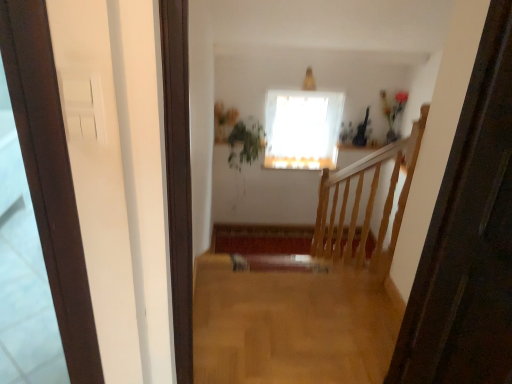
Question: Is the position of white sheer curtain at upper center more distant than that of green leafy plant at upper center?

Choices:
 (A) no
 (B) yes

Answer: (B)

Question: Is white sheer curtain at upper center thinner than green leafy plant at upper center?

Choices:
 (A) yes
 (B) no

Answer: (A)

Question: Would you say white sheer curtain at upper center contains green leafy plant at upper center?

Choices:
 (A) yes
 (B) no

Answer: (B)

Question: Can you confirm if white sheer curtain at upper center is shorter than green leafy plant at upper center?

Choices:
 (A) no
 (B) yes

Answer: (A)

Question: Is white sheer curtain at upper center not close to green leafy plant at upper center?

Choices:
 (A) no
 (B) yes

Answer: (A)

Question: From a real-world perspective, is white sheer curtain at upper center above or below light brown wood floor at center?

Choices:
 (A) above
 (B) below

Answer: (B)

Question: In terms of size, does white sheer curtain at upper center appear bigger or smaller than light brown wood floor at center?

Choices:
 (A) small
 (B) big

Answer: (B)

Question: Is white sheer curtain at upper center taller or shorter than light brown wood floor at center?

Choices:
 (A) short
 (B) tall

Answer: (B)

Question: From the image's perspective, relative to light brown wood floor at center, is white sheer curtain at upper center above or below?

Choices:
 (A) above
 (B) below

Answer: (A)

Question: In terms of width, does light brown wood floor at center look wider or thinner when compared to white sheer curtain at upper center?

Choices:
 (A) wide
 (B) thin

Answer: (A)

Question: Would you say light brown wood floor at center is inside or outside white sheer curtain at upper center?

Choices:
 (A) outside
 (B) inside

Answer: (A)

Question: In the image, is light brown wood floor at center on the left side or the right side of white sheer curtain at upper center?

Choices:
 (A) right
 (B) left

Answer: (B)

Question: In terms of height, does light brown wood floor at center look taller or shorter compared to white sheer curtain at upper center?

Choices:
 (A) short
 (B) tall

Answer: (A)

Question: Do you think green leafy plant at upper center is within light brown wood floor at center, or outside of it?

Choices:
 (A) outside
 (B) inside

Answer: (A)

Question: In terms of size, does green leafy plant at upper center appear bigger or smaller than light brown wood floor at center?

Choices:
 (A) big
 (B) small

Answer: (A)